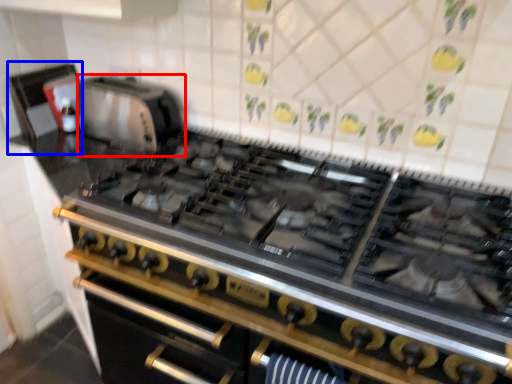
Question: Which object appears farthest to the camera in this image, appliance (highlighted by a red box) or appliance (highlighted by a blue box)?

Choices:
 (A) appliance
 (B) appliance

Answer: (B)